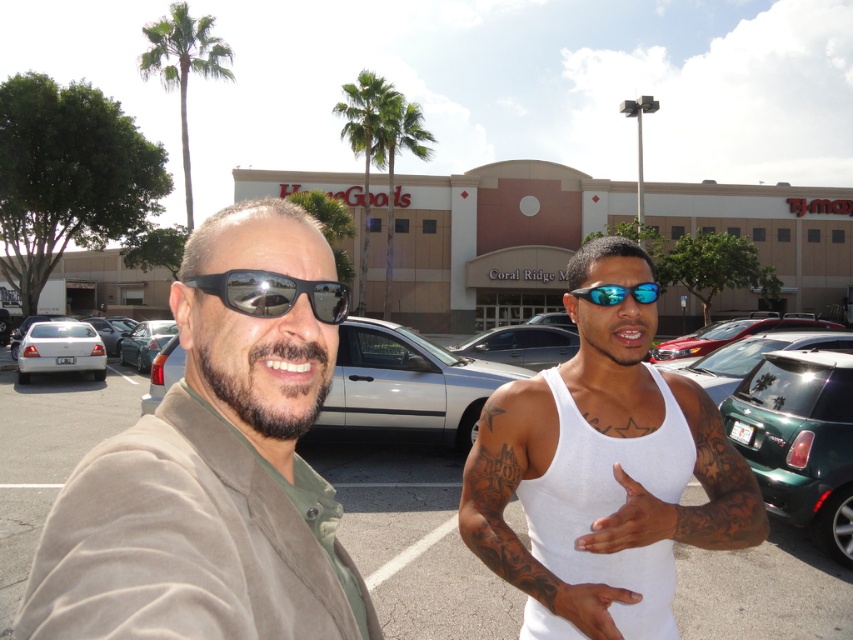
Does white tank top at center have a lesser height compared to satin silver sedan at center?

In fact, white tank top at center may be taller than satin silver sedan at center.

From the picture: Which of these two, white tank top at center or satin silver sedan at center, stands taller?

white tank top at center

Looking at this image, measure the distance between point (585, 310) and camera.

1.91 meters

In order to click on white tank top at center in this screenshot , I will do `click(602, 483)`.

Who is higher up, green matte car at right or green leafy palm tree at upper center?

green leafy palm tree at upper center is above.

Which is in front, point (836, 497) or point (358, 145)?

Point (836, 497) is in front.

Is point (846, 465) in front of point (372, 76)?

Yes, it is in front of point (372, 76).

Locate an element on the screen. green matte car at right is located at coordinates (799, 440).

Who is taller, white asphalt parking lot at center or satin silver sedan at center?

white asphalt parking lot at center is taller.

You are a GUI agent. You are given a task and a screenshot of the screen. Output one action in this format:
    pyautogui.click(x=<x>, y=<y>)
    Task: Click on the white asphalt parking lot at center
    
    Given the screenshot: What is the action you would take?
    pyautogui.click(x=410, y=536)

Find the location of a particular element. The height and width of the screenshot is (640, 853). white asphalt parking lot at center is located at coordinates (410, 536).

I want to click on white asphalt parking lot at center, so click(410, 536).